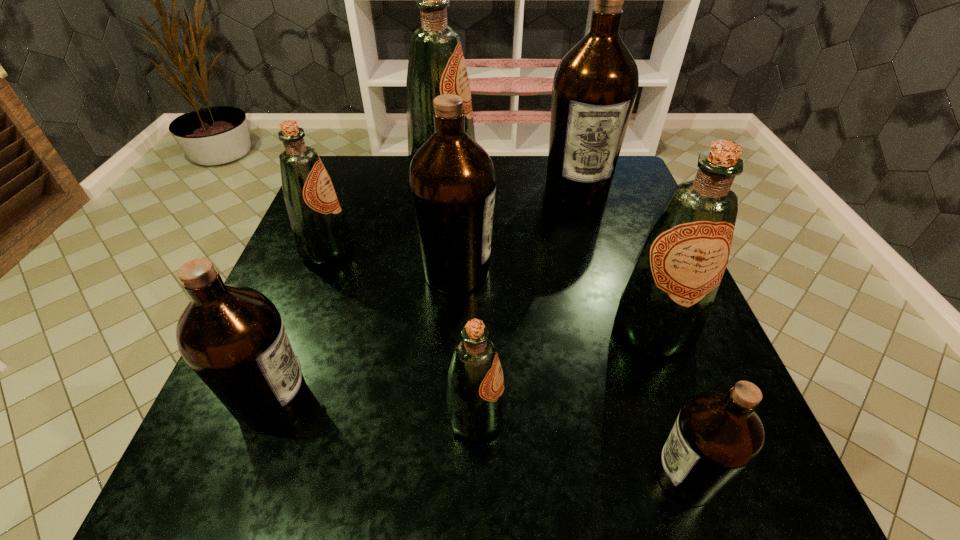
Where is `the nearest green olive oil`? the nearest green olive oil is located at coordinates (475, 405).

At what (x,y) coordinates should I click in order to perform the action: click on the nearest brown olive oil. Please return your answer as a coordinate pair (x, y). This screenshot has width=960, height=540. Looking at the image, I should click on (717, 436).

You are a GUI agent. You are given a task and a screenshot of the screen. Output one action in this format:
    pyautogui.click(x=<x>, y=<y>)
    Task: Click on the vacant space located on the front-facing side of the farthest green olive oil
    Image resolution: width=960 pixels, height=540 pixels.
    Given the screenshot: What is the action you would take?
    pyautogui.click(x=590, y=172)

Locate an element on the screen. free space located 0.190m on the label of the biggest brown olive oil is located at coordinates (597, 259).

Image resolution: width=960 pixels, height=540 pixels. Find the location of `blank space located 0.120m on the label of the third smallest brown olive oil`. blank space located 0.120m on the label of the third smallest brown olive oil is located at coordinates (549, 272).

Where is `free spot located 0.120m on the front-facing side of the rightmost green olive oil`? The width and height of the screenshot is (960, 540). free spot located 0.120m on the front-facing side of the rightmost green olive oil is located at coordinates pos(688,425).

You are a GUI agent. You are given a task and a screenshot of the screen. Output one action in this format:
    pyautogui.click(x=<x>, y=<y>)
    Task: Click on the vacant region located 0.090m on the front-facing side of the second smallest green olive oil
    The height and width of the screenshot is (540, 960).
    Given the screenshot: What is the action you would take?
    pyautogui.click(x=394, y=249)

The height and width of the screenshot is (540, 960). Find the location of `free space located 0.150m on the label of the third biggest brown olive oil`. free space located 0.150m on the label of the third biggest brown olive oil is located at coordinates (403, 402).

Where is `vacant area located 0.120m on the front-facing side of the smallest green olive oil`? vacant area located 0.120m on the front-facing side of the smallest green olive oil is located at coordinates coord(580,417).

Find the location of a particular element. The width and height of the screenshot is (960, 540). vacant space located on the label of the nearest brown olive oil is located at coordinates point(564,476).